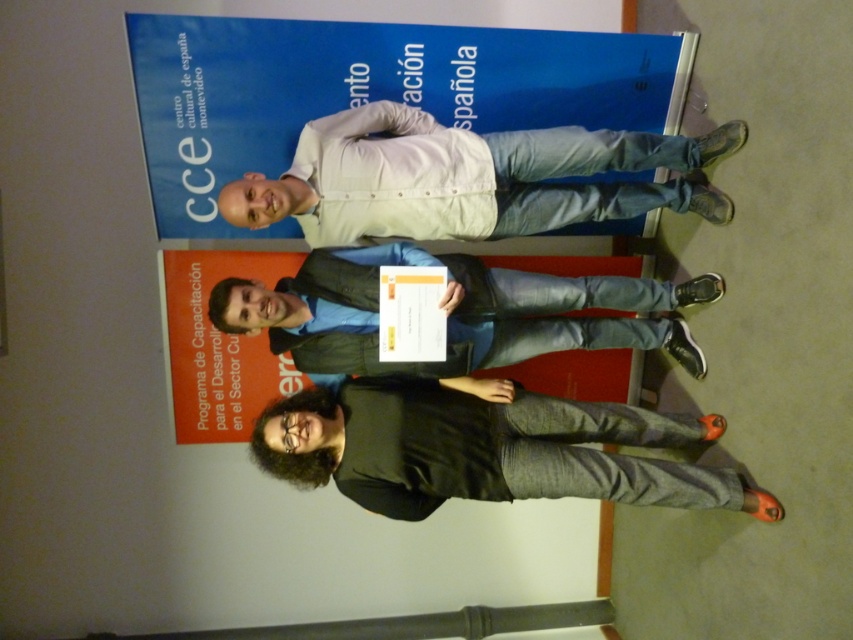
You are a photographer setting up for a group photo. You notice the dark gray cotton pants at lower center and the white matte shirt at center. Which clothing item is shorter in height?

The dark gray cotton pants at lower center has a lesser height compared to the white matte shirt at center, so the dark gray cotton pants at lower center is shorter in height.

You are a photographer adjusting the camera focus. You notice two shirts at the center of the image, a white matte shirt at center and a matte black shirt at center. Which shirt should you focus on first to ensure both are in focus?

The white matte shirt at center is taller than the matte black shirt at center, so focusing on the white matte shirt at center first will ensure both shirts are in focus since it is the taller one and likely closer to the camera.